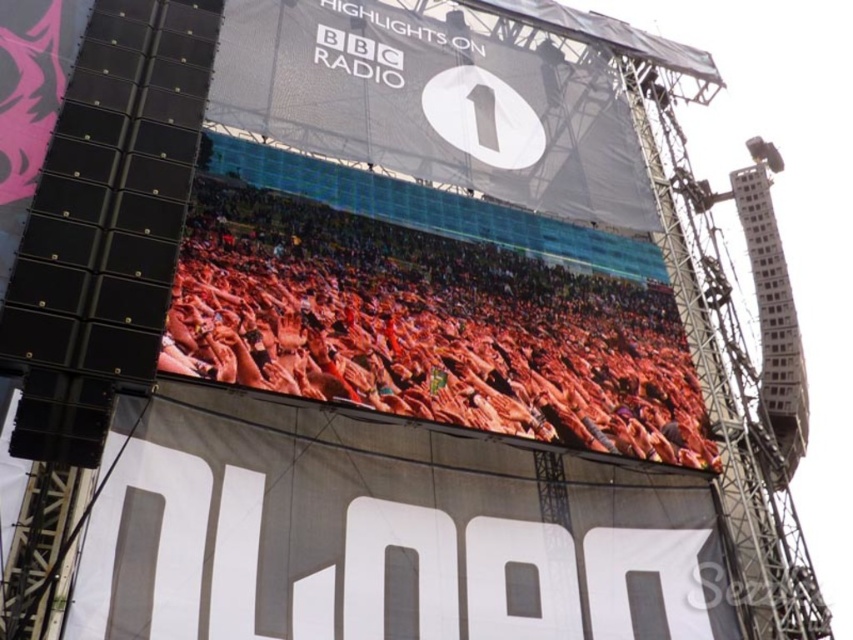
Question: Which point is closer to the camera?

Choices:
 (A) (144, 522)
 (B) (590, 326)

Answer: (A)

Question: Does white matte sign at center appear on the right side of orange fabric crowd at center?

Choices:
 (A) yes
 (B) no

Answer: (B)

Question: Can you confirm if white matte sign at center is positioned to the right of white fabric billboard at upper center?

Choices:
 (A) no
 (B) yes

Answer: (A)

Question: Which point is farther to the camera?

Choices:
 (A) (218, 589)
 (B) (351, 0)
 (C) (392, 355)

Answer: (B)

Question: Does white matte sign at center have a smaller size compared to white fabric billboard at upper center?

Choices:
 (A) yes
 (B) no

Answer: (A)

Question: Which point is farther to the camera?

Choices:
 (A) (511, 125)
 (B) (252, 256)

Answer: (A)